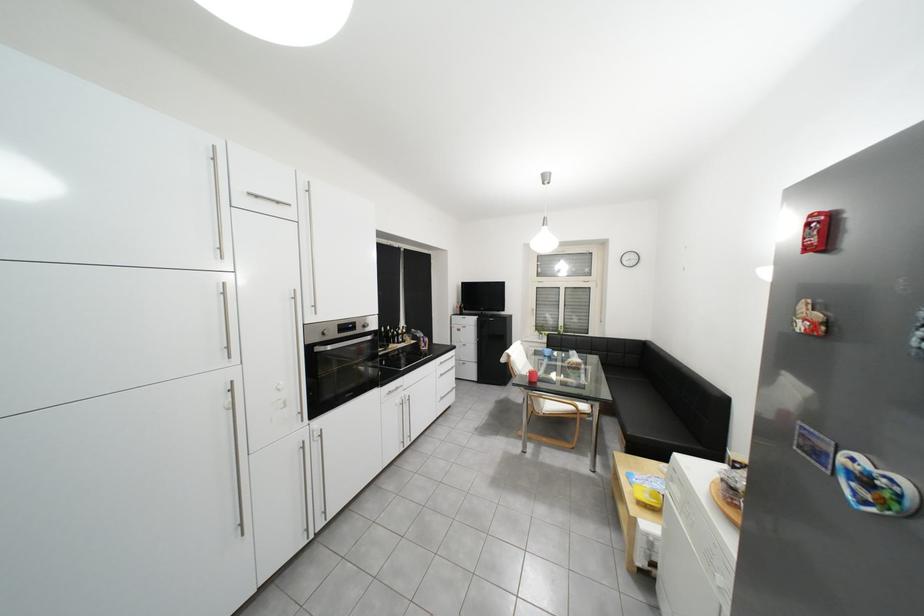
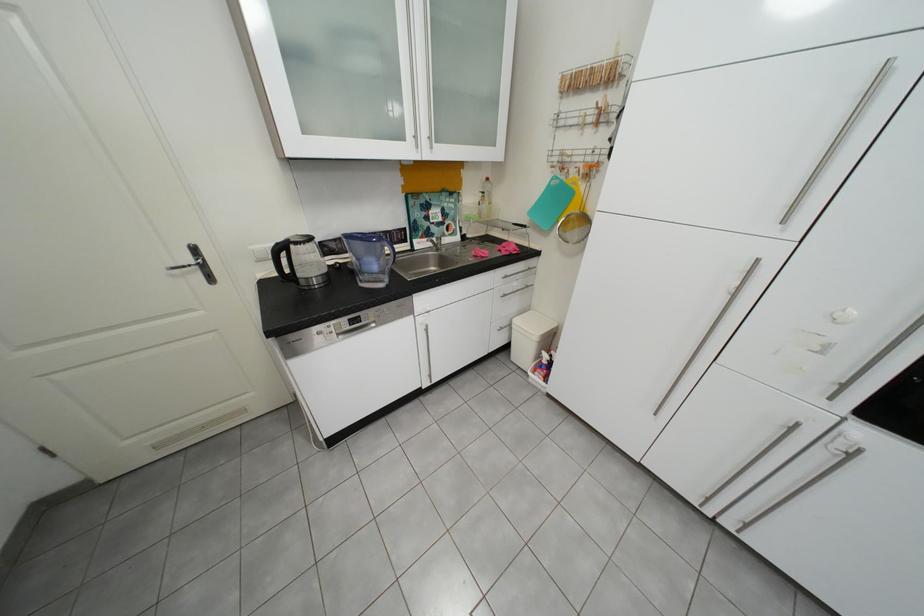
Based on the continuous images, in which direction is the camera rotating?

The camera rotated toward left-down.